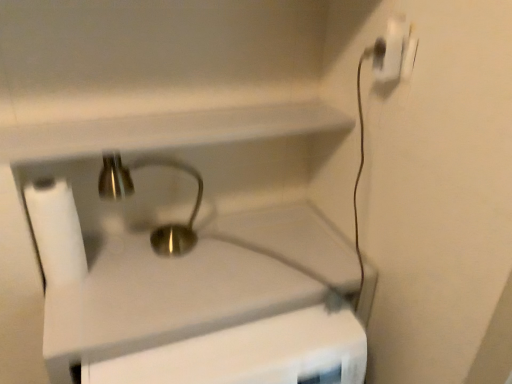
Where is `free location to the right of polished brass faucet at center`? free location to the right of polished brass faucet at center is located at coordinates (225, 248).